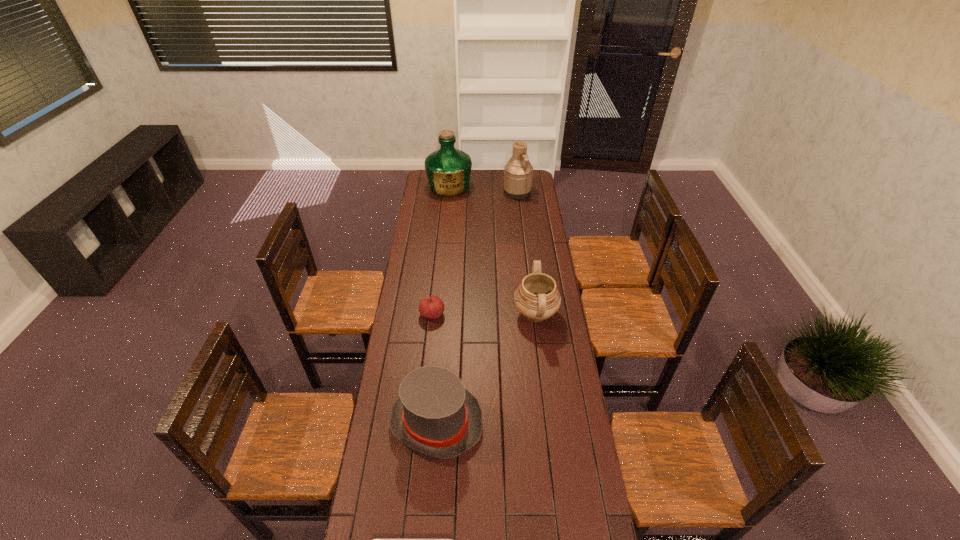
You are a GUI agent. You are given a task and a screenshot of the screen. Output one action in this format:
    pyautogui.click(x=<x>, y=<y>)
    Task: Click on the free spot between the dress hat and the pitcher
    The width and height of the screenshot is (960, 540).
    Given the screenshot: What is the action you would take?
    pyautogui.click(x=477, y=307)

The image size is (960, 540). Identify the location of the closest object relative to the liquor. (518, 173).

Image resolution: width=960 pixels, height=540 pixels. I want to click on the third closest object to the liquor, so click(431, 307).

Identify the location of free spot that satisfies the following two spatial constraints: 1. on the label side of the liquor; 2. on the left side of the pitcher. This screenshot has height=540, width=960. (449, 192).

Find the location of a particular element. Image resolution: width=960 pixels, height=540 pixels. vacant space that satisfies the following two spatial constraints: 1. on the label side of the dress hat; 2. on the right side of the liquor is located at coordinates (427, 422).

Where is `free space that satisfies the following two spatial constraints: 1. on the label side of the pitcher; 2. on the left side of the liquor`? The image size is (960, 540). free space that satisfies the following two spatial constraints: 1. on the label side of the pitcher; 2. on the left side of the liquor is located at coordinates (449, 192).